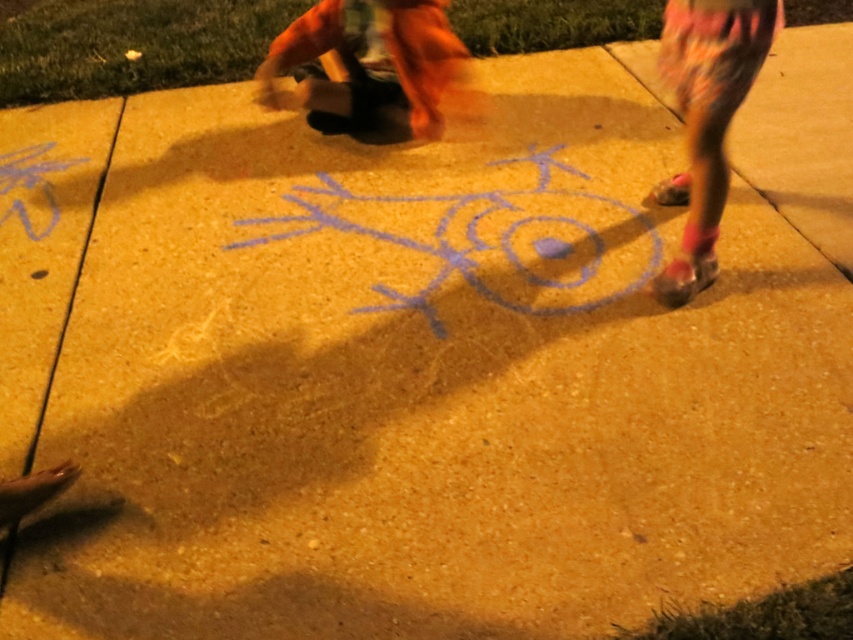
Question: Which of the following is the farthest from the observer?

Choices:
 (A) (630, 209)
 (B) (728, 122)

Answer: (A)

Question: Among these points, which one is nearest to the camera?

Choices:
 (A) (381, 20)
 (B) (692, 32)

Answer: (B)

Question: Can you confirm if orange fabric pants at upper center is thinner than floral leggings at right?

Choices:
 (A) no
 (B) yes

Answer: (A)

Question: Observing the image, what is the correct spatial positioning of orange fabric pants at upper center in reference to floral leggings at right?

Choices:
 (A) above
 (B) below

Answer: (A)

Question: Which object is positioned farthest from the floral leggings at right?

Choices:
 (A) blue chalk drawing at center
 (B) orange fabric pants at upper center

Answer: (B)

Question: Does blue chalk drawing at center have a lesser width compared to floral leggings at right?

Choices:
 (A) no
 (B) yes

Answer: (A)